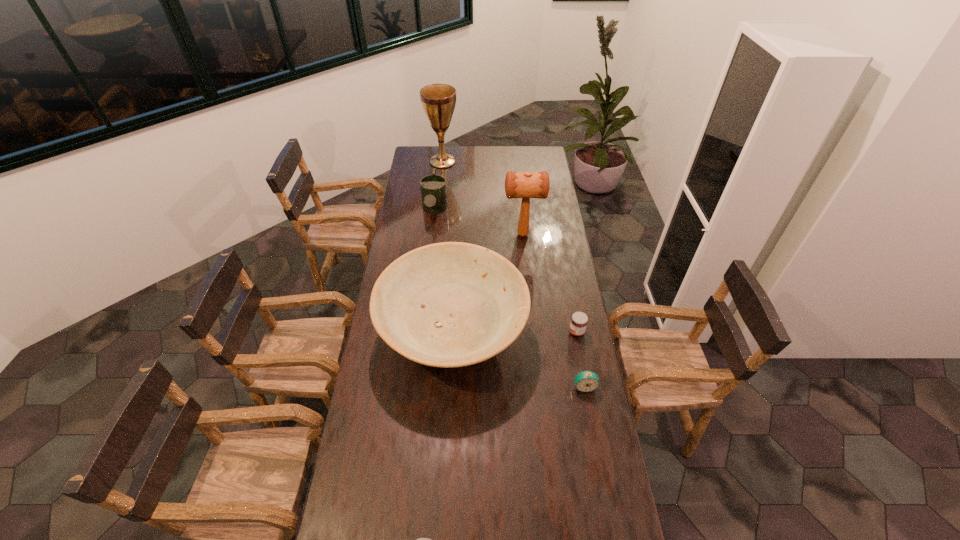
In order to click on alarm clock at the right edge in this screenshot , I will do `click(586, 381)`.

Identify the location of jam that is at the right edge. (579, 320).

This screenshot has height=540, width=960. Find the location of `object present at the far left corner`. object present at the far left corner is located at coordinates (438, 100).

Where is `free spot at the far edge of the desktop`? This screenshot has width=960, height=540. free spot at the far edge of the desktop is located at coordinates (515, 152).

In the image, there is a desktop. In order to click on free space at the left edge in this screenshot , I will do `click(409, 208)`.

The height and width of the screenshot is (540, 960). I want to click on free spot at the right edge of the desktop, so click(x=541, y=215).

The image size is (960, 540). Identify the location of empty space that is in between the trophy cup and the jam. (510, 247).

This screenshot has width=960, height=540. Identify the location of free space between the jam and the farthest object. (510, 247).

Locate an element on the screen. This screenshot has width=960, height=540. blank region between the mallet and the fourth shortest object is located at coordinates (479, 222).

At what (x,y) coordinates should I click in order to perform the action: click on object that ranks as the closest to the fourth tallest object. Please return your answer as a coordinate pair (x, y). Looking at the image, I should click on (438, 100).